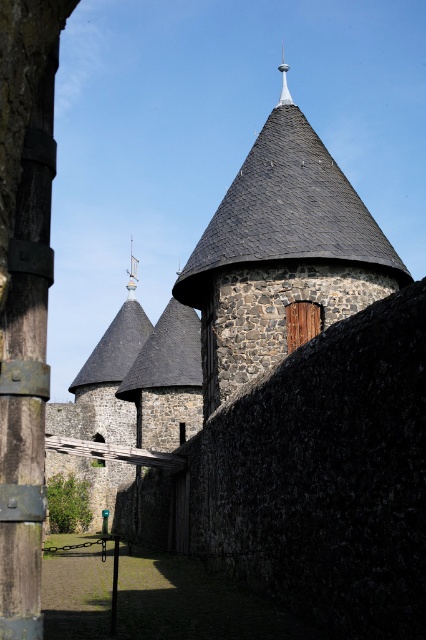
Between dark gray stone tower at center and shiny silver spire at center, which one has more height?

Standing taller between the two is shiny silver spire at center.

Is dark gray stone tower at center shorter than shiny silver spire at center?

Indeed, dark gray stone tower at center has a lesser height compared to shiny silver spire at center.

Between point (236, 358) and point (132, 237), which one is positioned in front?

Point (236, 358) is in front.

Image resolution: width=426 pixels, height=640 pixels. Find the location of `dark gray stone tower at center`. dark gray stone tower at center is located at coordinates (281, 253).

Can you confirm if dark gray stone tower at center is bigger than silver metallic spire at upper center?

Incorrect, dark gray stone tower at center is not larger than silver metallic spire at upper center.

Between dark gray stone tower at center and silver metallic spire at upper center, which one appears on the left side from the viewer's perspective?

dark gray stone tower at center

Does point (293, 189) come closer to viewer compared to point (282, 60)?

Yes, it is.

Where is `dark gray stone tower at center`? dark gray stone tower at center is located at coordinates (281, 253).

Which is behind, point (288, 99) or point (129, 294)?

Point (129, 294)

Does silver metallic spire at upper center have a lesser height compared to shiny silver spire at center?

No.

Between point (284, 80) and point (132, 275), which one is positioned behind?

Point (284, 80)

Locate an element on the screen. The height and width of the screenshot is (640, 426). silver metallic spire at upper center is located at coordinates (284, 83).